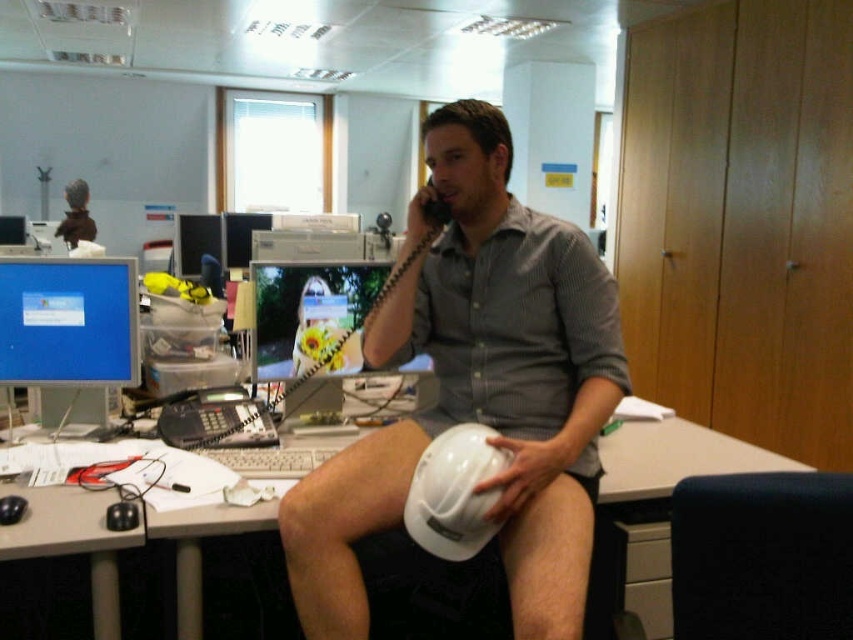
Question: Does matte black monitor at upper left have a larger size compared to matte black monitor at center?

Choices:
 (A) yes
 (B) no

Answer: (A)

Question: Which object is farther from the camera taking this photo?

Choices:
 (A) white hard hat at center
 (B) matte black monitor at upper left

Answer: (B)

Question: Does matte blue monitor at left appear on the left side of matte black monitor at center?

Choices:
 (A) yes
 (B) no

Answer: (B)

Question: Based on their relative distances, which object is farther from the white hard hat at center?

Choices:
 (A) matte blue monitor at left
 (B) matte black monitor at center
 (C) matte gray desk at center

Answer: (B)

Question: Which of the following is the farthest from the observer?

Choices:
 (A) white matte hard hat at center
 (B) matte blue monitor at left
 (C) matte black monitor at center
 (D) matte gray desk at center

Answer: (C)

Question: Is white matte hard hat at center below matte black monitor at center?

Choices:
 (A) no
 (B) yes

Answer: (B)